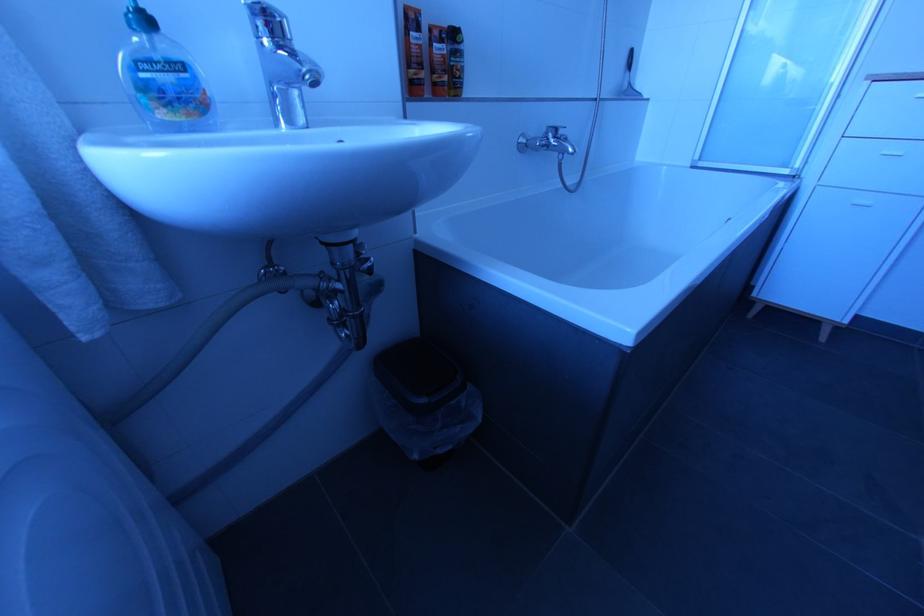
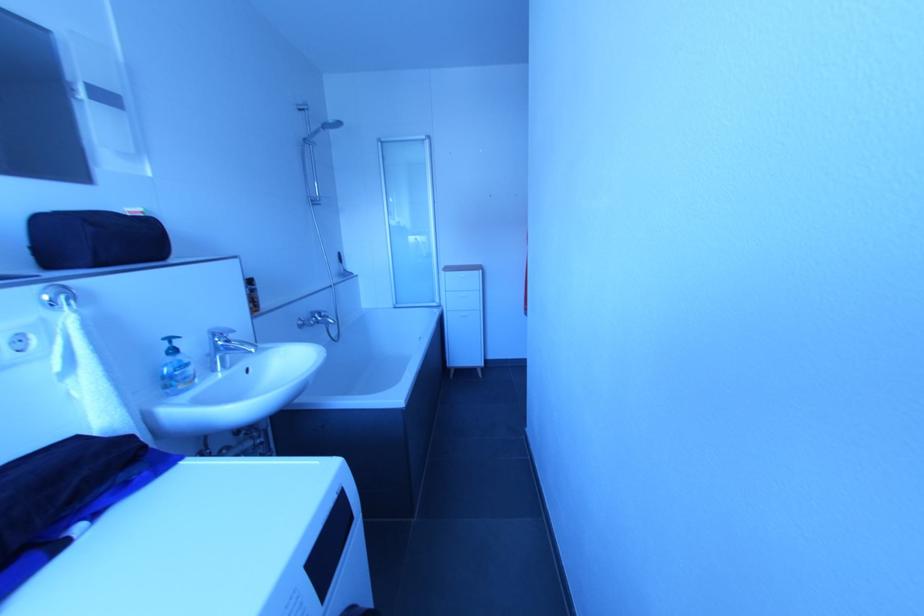
Question: The camera is either moving clockwise (left) or counter-clockwise (right) around the object. The first image is from the beginning of the video and the second image is from the end. Is the camera moving left or right when shooting the video?

Choices:
 (A) Left
 (B) Right

Answer: (A)